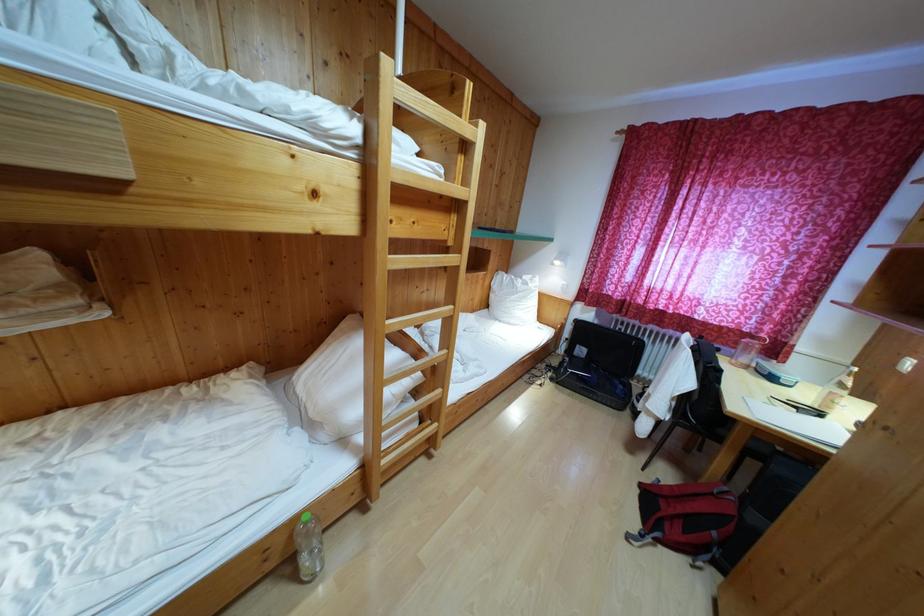
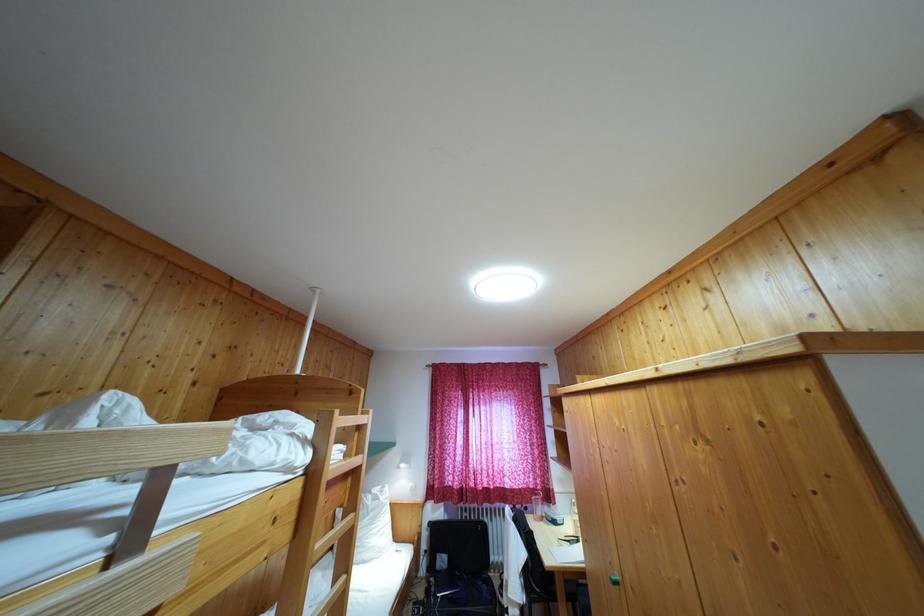
In the second image, find the point that corresponds to (x=759, y=446) in the first image.

(569, 589)